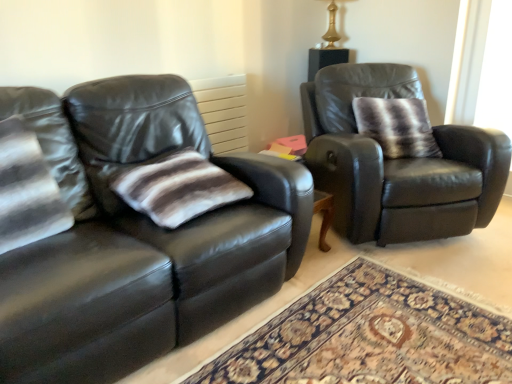
Question: From the image's perspective, is striped fabric pillow at center, which is counted as the second pillow, starting from the back, above gold metallic table lamp at upper center?

Choices:
 (A) no
 (B) yes

Answer: (A)

Question: Is striped fabric pillow at center, positioned as the second pillow in top-to-bottom order, shorter than gold metallic table lamp at upper center?

Choices:
 (A) no
 (B) yes

Answer: (B)

Question: Does striped fabric pillow at center, the first pillow positioned from the left, lie behind gold metallic table lamp at upper center?

Choices:
 (A) yes
 (B) no

Answer: (B)

Question: Is striped fabric pillow at center, arranged as the 2th pillow when viewed from the right, oriented away from gold metallic table lamp at upper center?

Choices:
 (A) no
 (B) yes

Answer: (A)

Question: Is striped fabric pillow at center, which is counted as the second pillow, starting from the back, far from gold metallic table lamp at upper center?

Choices:
 (A) yes
 (B) no

Answer: (A)

Question: From a real-world perspective, is gold metallic table lamp at upper center positioned above or below striped fur pillow at right, acting as the first pillow starting from the top?

Choices:
 (A) above
 (B) below

Answer: (A)

Question: From the image's perspective, is gold metallic table lamp at upper center located above or below striped fur pillow at right, acting as the first pillow starting from the top?

Choices:
 (A) below
 (B) above

Answer: (B)

Question: Does point (332, 44) appear closer or farther from the camera than point (415, 97)?

Choices:
 (A) farther
 (B) closer

Answer: (A)

Question: Relative to striped fur pillow at right, which is the second pillow from left to right, is gold metallic table lamp at upper center in front or behind?

Choices:
 (A) behind
 (B) front

Answer: (A)

Question: From a real-world perspective, is striped fabric pillow at center, positioned as the second pillow in top-to-bottom order, positioned above or below gold metallic table lamp at upper center?

Choices:
 (A) above
 (B) below

Answer: (B)

Question: Is striped fabric pillow at center, positioned as the second pillow in top-to-bottom order, wider or thinner than gold metallic table lamp at upper center?

Choices:
 (A) wide
 (B) thin

Answer: (A)

Question: In terms of size, does striped fabric pillow at center, the 1th pillow viewed from the front, appear bigger or smaller than gold metallic table lamp at upper center?

Choices:
 (A) small
 (B) big

Answer: (B)

Question: Is striped fabric pillow at center, positioned as the second pillow in top-to-bottom order, in front of or behind gold metallic table lamp at upper center in the image?

Choices:
 (A) front
 (B) behind

Answer: (A)

Question: Is point (402, 99) positioned closer to the camera than point (184, 210)?

Choices:
 (A) farther
 (B) closer

Answer: (A)

Question: Is striped fur pillow at right, which ranks as the second pillow in bottom-to-top order, situated inside striped fabric pillow at center, positioned as the second pillow in top-to-bottom order, or outside?

Choices:
 (A) inside
 (B) outside

Answer: (B)